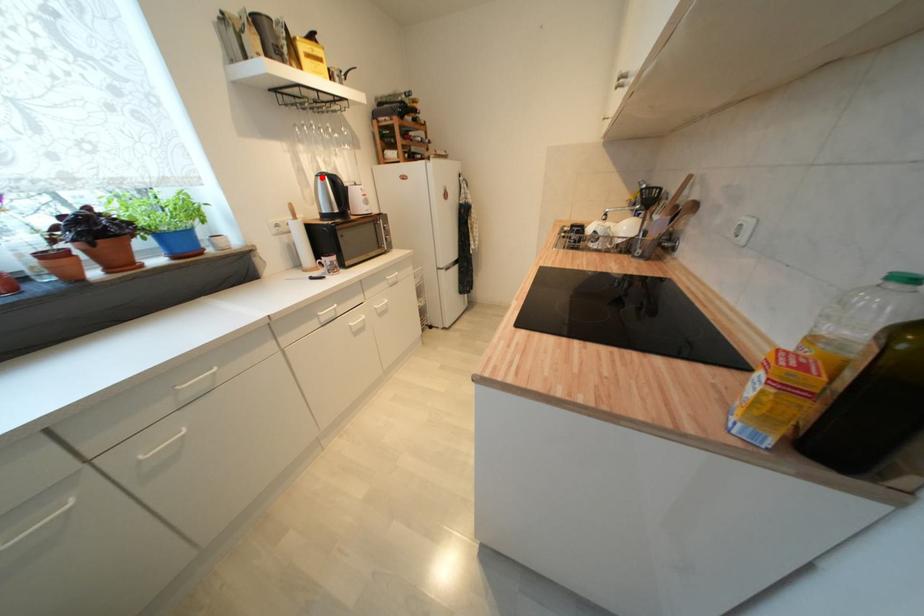
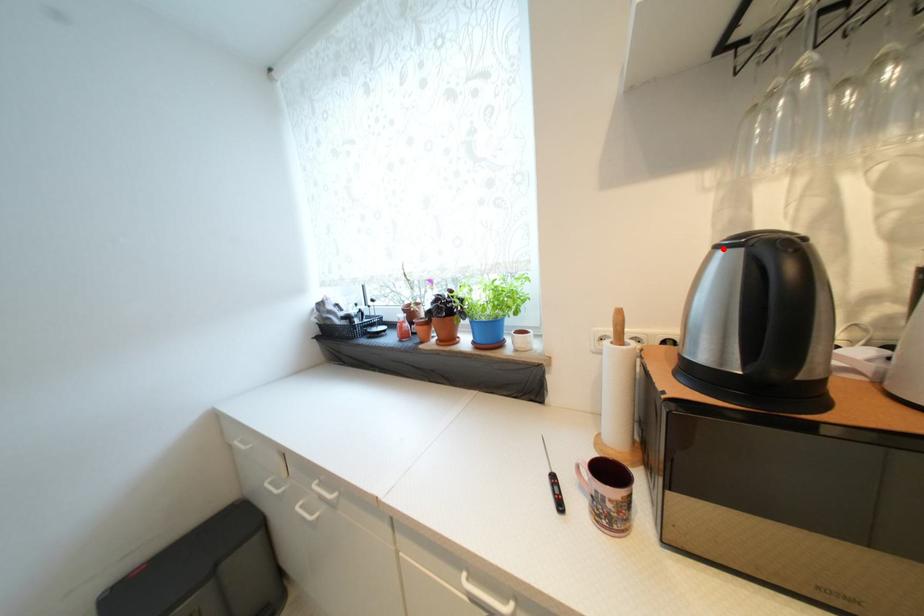
I am providing you with two images of the same scene from different viewpoints. A red point is marked on the first image and another point is marked on the second image. Are the points marked in image1 and image2 representing the same 3D position?

Yes